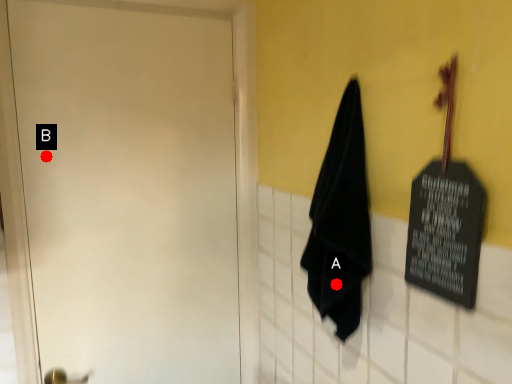
Question: Two points are circled on the image, labeled by A and B beside each circle. Which point appears farthest from the camera in this image?

Choices:
 (A) A is further
 (B) B is further

Answer: (B)